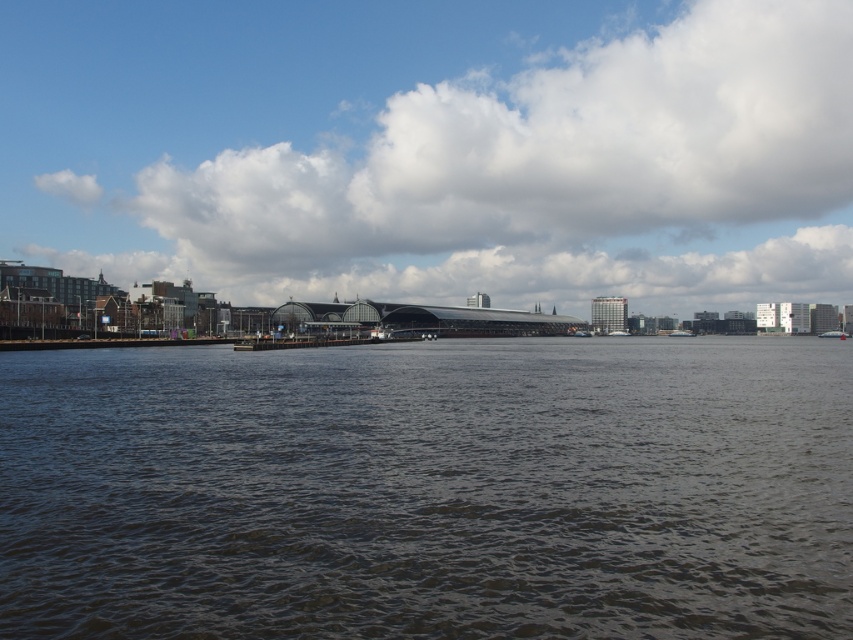
Question: Is dark water at center closer to camera compared to white plastic boat at right?

Choices:
 (A) yes
 (B) no

Answer: (A)

Question: Is dark water at center positioned in front of metallic silver boat at center?

Choices:
 (A) yes
 (B) no

Answer: (A)

Question: Which object is farther from the camera taking this photo?

Choices:
 (A) white plastic boat at right
 (B) metallic silver boat at center

Answer: (B)

Question: Which point appears closest to the camera in this image?

Choices:
 (A) [763, 600]
 (B) [828, 330]
 (C) [132, 49]

Answer: (A)

Question: Which point is farther to the camera?

Choices:
 (A) dark water at center
 (B) white fluffy cloud at upper center

Answer: (B)

Question: Can you confirm if dark water at center is positioned to the left of white fluffy cloud at upper center?

Choices:
 (A) no
 (B) yes

Answer: (A)